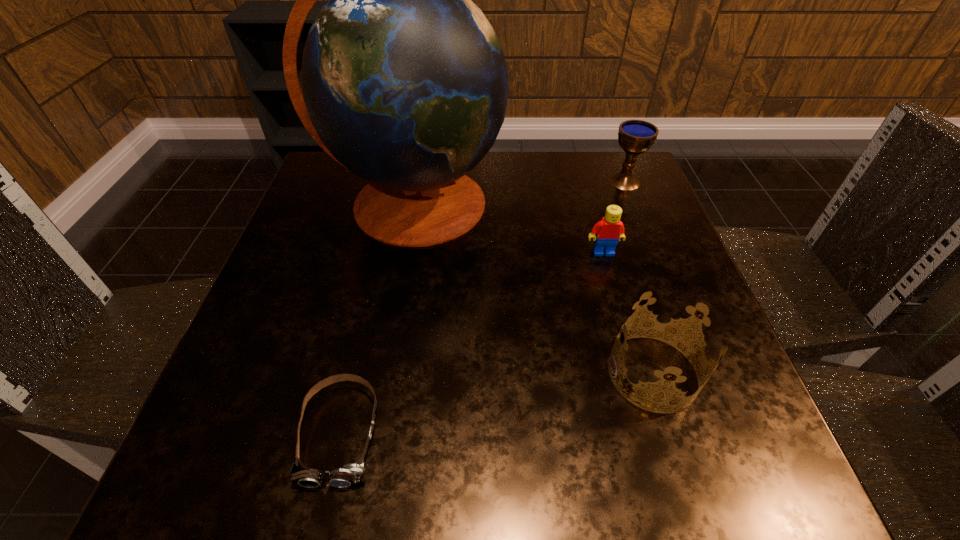
Find the location of a particular element. The width and height of the screenshot is (960, 540). chalice present at the far edge is located at coordinates (635, 137).

You are a GUI agent. You are given a task and a screenshot of the screen. Output one action in this format:
    pyautogui.click(x=<x>, y=<y>)
    Task: Click on the object located in the near edge section of the desktop
    
    Given the screenshot: What is the action you would take?
    pyautogui.click(x=349, y=474)

The height and width of the screenshot is (540, 960). In order to click on globe located at the left edge in this screenshot , I will do `click(404, 83)`.

In order to click on goggles that is positioned at the left edge in this screenshot , I will do `click(349, 474)`.

This screenshot has height=540, width=960. In order to click on chalice situated at the right edge in this screenshot , I will do `click(635, 137)`.

This screenshot has height=540, width=960. Find the location of `crown at the right edge`. crown at the right edge is located at coordinates (685, 323).

Where is `Lego that is at the right edge`? This screenshot has width=960, height=540. Lego that is at the right edge is located at coordinates click(x=610, y=229).

The height and width of the screenshot is (540, 960). I want to click on object that is at the far left corner, so click(x=404, y=83).

This screenshot has height=540, width=960. I want to click on object that is at the near left corner, so click(x=349, y=474).

At what (x,y) coordinates should I click in order to perform the action: click on object located in the far right corner section of the desktop. Please return your answer as a coordinate pair (x, y). Looking at the image, I should click on (635, 137).